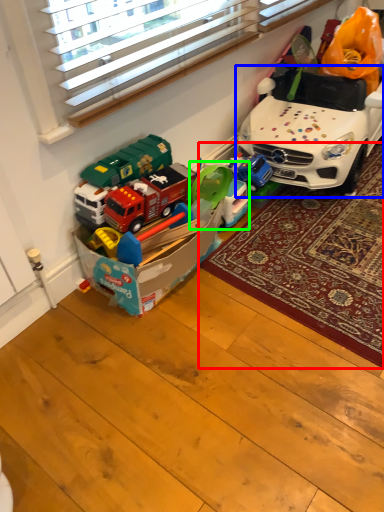
Question: Based on their relative distances, which object is farther from mat (highlighted by a red box)? Choose from car (highlighted by a blue box) and toy (highlighted by a green box).

Choices:
 (A) car
 (B) toy

Answer: (B)